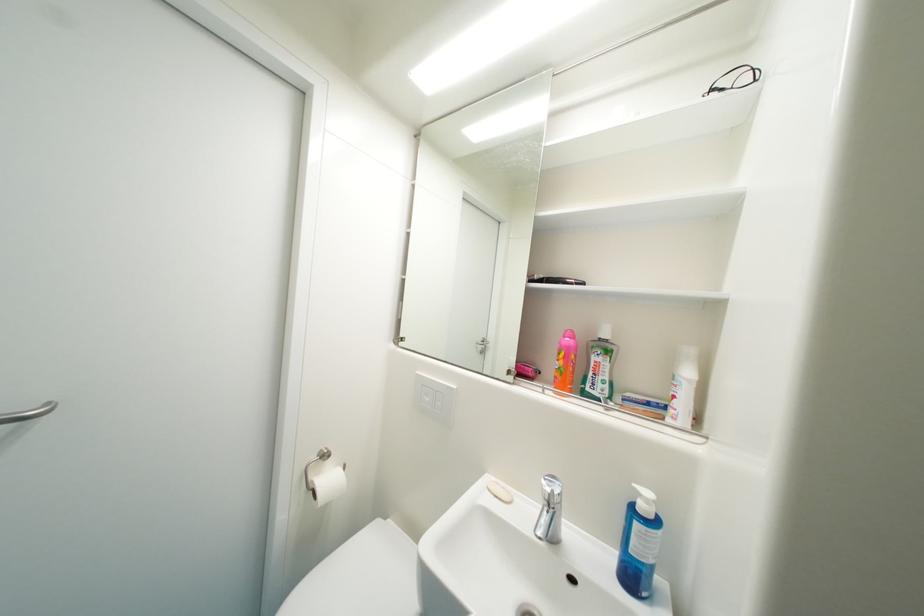
Find the location of `mirrored cabinet door`. mirrored cabinet door is located at coordinates (473, 229).